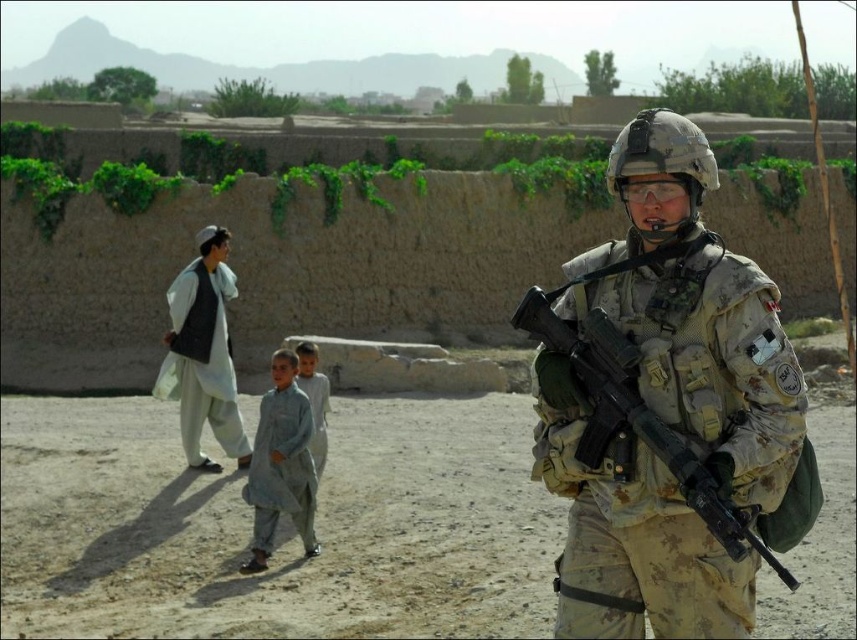
Is camouflage fabric uniform at center to the left of light gray fabric at left from the viewer's perspective?

No, camouflage fabric uniform at center is not to the left of light gray fabric at left.

Does point (709, 253) come in front of point (165, 364)?

That is True.

Locate an element on the screen. Image resolution: width=857 pixels, height=640 pixels. camouflage fabric uniform at center is located at coordinates (696, 316).

Find the location of `dirt field at center`. dirt field at center is located at coordinates (279, 531).

Does point (238, 545) come in front of point (309, 364)?

Yes, point (238, 545) is closer to viewer.

Image resolution: width=857 pixels, height=640 pixels. I want to click on dirt field at center, so click(279, 531).

Can you confirm if camouflage fabric uniform at center is positioned to the left of light gray fabric child at center?

Incorrect, camouflage fabric uniform at center is not on the left side of light gray fabric child at center.

Is camouflage fabric uniform at center bigger than light gray fabric child at center?

Yes.

Where is `camouflage fabric uniform at center`? The image size is (857, 640). camouflage fabric uniform at center is located at coordinates (696, 316).